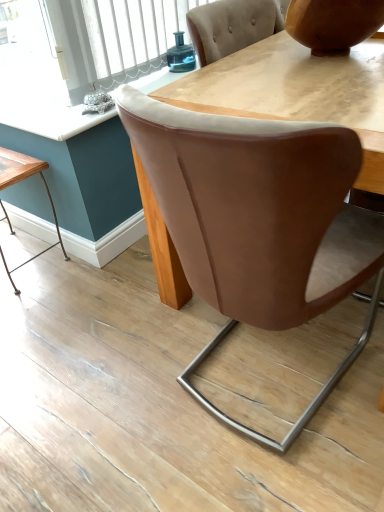
Identify the location of teal glass jar at upper center. coord(181,55).

The height and width of the screenshot is (512, 384). What are the coordinates of `matte wooden table at center` in the screenshot? It's located at (296, 92).

Does teal glass jar at upper center appear on the left side of matte brown vase at upper right?

Yes.

From the image's perspective, relative to matte brown vase at upper right, is teal glass jar at upper center above or below?

Based on their image positions, teal glass jar at upper center is located above matte brown vase at upper right.

Considering the sizes of objects teal glass jar at upper center and matte brown vase at upper right in the image provided, who is bigger, teal glass jar at upper center or matte brown vase at upper right?

matte brown vase at upper right.

Who is bigger, wooden table at lower left or brown leather chair at center?

brown leather chair at center.

From the image's perspective, who appears lower, wooden table at lower left or brown leather chair at center?

wooden table at lower left appears lower in the image.

Does wooden table at lower left touch brown leather chair at center?

There is a gap between wooden table at lower left and brown leather chair at center.

Is wooden table at lower left wider or thinner than brown leather chair at center?

Considering their sizes, wooden table at lower left looks slimmer than brown leather chair at center.

Is the position of wooden table at lower left more distant than that of teal glass jar at upper center?

That is False.

Locate an element on the screen. Image resolution: width=384 pixels, height=512 pixels. table below the teal glass jar at upper center (from a real-world perspective) is located at coordinates (19, 181).

Is wooden table at lower left smaller than teal glass jar at upper center?

No, wooden table at lower left is not smaller than teal glass jar at upper center.

What's the angular difference between wooden table at lower left and teal glass jar at upper center's facing directions?

They differ by 89.5 degrees in their facing directions.

Is there a large distance between teal glass jar at upper center and wooden table at lower left?

No, teal glass jar at upper center is in close proximity to wooden table at lower left.

Is teal glass jar at upper center closer to camera compared to wooden table at lower left?

No, teal glass jar at upper center is behind wooden table at lower left.

From the image's perspective, is teal glass jar at upper center located above wooden table at lower left?

Yes.

The image size is (384, 512). I want to click on teal above the wooden table at lower left (from a real-world perspective), so click(x=181, y=55).

Based on the photo, does matte wooden table at center have a larger size compared to brown leather chair at center?

No.

From the image's perspective, is matte wooden table at center above or below brown leather chair at center?

Clearly, from the image's perspective, matte wooden table at center is above brown leather chair at center.

Does matte wooden table at center have a lesser height compared to brown leather chair at center?

Yes, matte wooden table at center is shorter than brown leather chair at center.

Is the depth of matte wooden table at center less than that of brown leather chair at center?

No.

Can you confirm if brown leather chair at center is positioned to the left of wooden table at lower left?

No.

Based on the photo, considering the positions of objects brown leather chair at center and wooden table at lower left in the image provided, who is in front, brown leather chair at center or wooden table at lower left?

brown leather chair at center.

Could you tell me if brown leather chair at center is facing wooden table at lower left?

No, brown leather chair at center does not turn towards wooden table at lower left.

Measure the distance between brown leather chair at center and wooden table at lower left.

brown leather chair at center is 1.03 meters from wooden table at lower left.

How many degrees apart are the facing directions of matte brown vase at upper right and teal glass jar at upper center?

1.19 degrees.

Find the location of a particular element. teal above the matte brown vase at upper right (from the image's perspective) is located at coordinates (181, 55).

Is matte brown vase at upper right not near teal glass jar at upper center?

That's not correct — matte brown vase at upper right is a little close to teal glass jar at upper center.

Between point (375, 25) and point (171, 70), which one is positioned in front?

The point (375, 25) is in front.

Image resolution: width=384 pixels, height=512 pixels. I want to click on vase to the right of teal glass jar at upper center, so click(x=333, y=23).

Locate an element on the screen. This screenshot has height=512, width=384. chair that is above the wooden table at lower left (from a real-world perspective) is located at coordinates (259, 221).

Based on their spatial positions, is wooden table at lower left or teal glass jar at upper center further from brown leather chair at center?

teal glass jar at upper center is further to brown leather chair at center.

Considering their positions, is wooden table at lower left positioned closer to teal glass jar at upper center than matte brown vase at upper right?

The object closer to teal glass jar at upper center is matte brown vase at upper right.

Estimate the real-world distances between objects in this image. Which object is closer to matte wooden table at center, brown leather chair at center or matte brown vase at upper right?

matte brown vase at upper right is positioned closer to the anchor matte wooden table at center.

From the image, which object appears to be nearer to teal glass jar at upper center, matte wooden table at center or wooden table at lower left?

matte wooden table at center lies closer to teal glass jar at upper center than the other object.

From the image, which object appears to be nearer to brown leather chair at center, matte wooden table at center or teal glass jar at upper center?

matte wooden table at center is positioned closer to the anchor brown leather chair at center.

Looking at the image, which one is located closer to matte brown vase at upper right, matte wooden table at center or brown leather chair at center?

matte wooden table at center lies closer to matte brown vase at upper right than the other object.

Which object lies further to the anchor point matte brown vase at upper right, teal glass jar at upper center or brown leather chair at center?

Based on the image, brown leather chair at center appears to be further to matte brown vase at upper right.

Which object lies nearer to the anchor point matte brown vase at upper right, brown leather chair at center or matte wooden table at center?

Based on the image, matte wooden table at center appears to be nearer to matte brown vase at upper right.

Identify the location of teal between wooden table at lower left and matte brown vase at upper right. (181, 55).

The height and width of the screenshot is (512, 384). Identify the location of teal between wooden table at lower left and brown leather chair at center from left to right. (181, 55).

The height and width of the screenshot is (512, 384). In order to click on vase located between wooden table at lower left and brown leather chair at center in the left-right direction in this screenshot , I will do `click(333, 23)`.

Find the location of a particular element. round table between wooden table at lower left and brown leather chair at center is located at coordinates pyautogui.click(x=296, y=92).